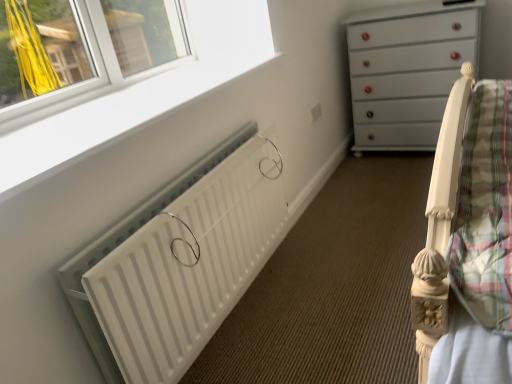
Identify the location of vacant region above white plastic window frame at upper left (from a real-world perspective). [110, 107].